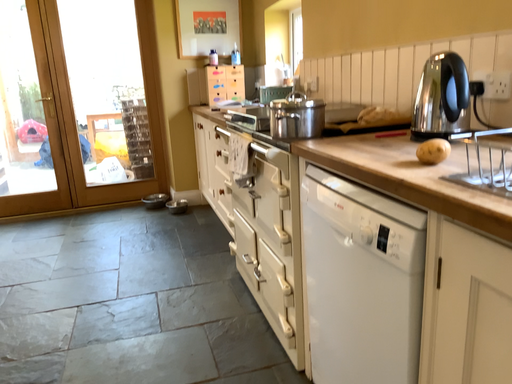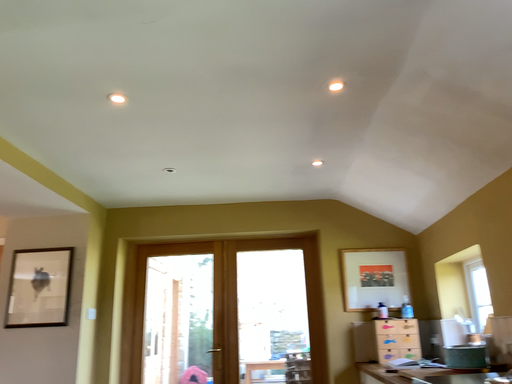
Question: How did the camera likely rotate when shooting the video?

Choices:
 (A) rotated left
 (B) rotated right

Answer: (A)